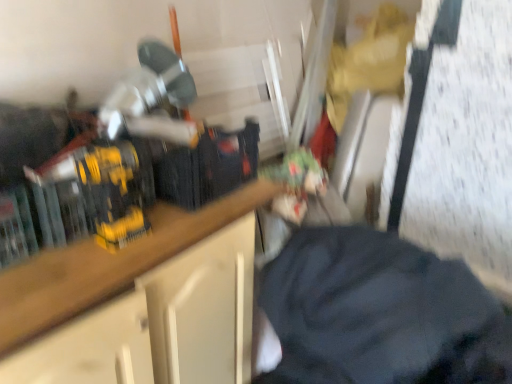
Question: Considering the relative sizes of wooden countertop at center and black fabric at center in the image provided, is wooden countertop at center shorter than black fabric at center?

Choices:
 (A) no
 (B) yes

Answer: (A)

Question: Is wooden countertop at center thinner than black fabric at center?

Choices:
 (A) no
 (B) yes

Answer: (B)

Question: Would you consider wooden countertop at center to be distant from black fabric at center?

Choices:
 (A) no
 (B) yes

Answer: (A)

Question: From the image's perspective, is wooden countertop at center on black fabric at center?

Choices:
 (A) no
 (B) yes

Answer: (A)

Question: Can you confirm if wooden countertop at center is bigger than black fabric at center?

Choices:
 (A) no
 (B) yes

Answer: (B)

Question: Is wooden countertop at center to the right of black fabric at center from the viewer's perspective?

Choices:
 (A) no
 (B) yes

Answer: (A)

Question: Can you confirm if black fabric at center is bigger than wooden countertop at center?

Choices:
 (A) no
 (B) yes

Answer: (A)

Question: Is wooden countertop at center at the back of black fabric at center?

Choices:
 (A) yes
 (B) no

Answer: (B)

Question: Is black fabric at center shorter than wooden countertop at center?

Choices:
 (A) yes
 (B) no

Answer: (A)

Question: Considering the relative positions of black fabric at center and wooden countertop at center in the image provided, is black fabric at center in front of wooden countertop at center?

Choices:
 (A) no
 (B) yes

Answer: (B)

Question: Considering the relative sizes of black fabric at center and wooden countertop at center in the image provided, is black fabric at center wider than wooden countertop at center?

Choices:
 (A) yes
 (B) no

Answer: (A)

Question: Is black fabric at center to the left of wooden countertop at center from the viewer's perspective?

Choices:
 (A) yes
 (B) no

Answer: (B)

Question: Which is correct: black fabric at center is inside wooden countertop at center, or outside of it?

Choices:
 (A) outside
 (B) inside

Answer: (A)